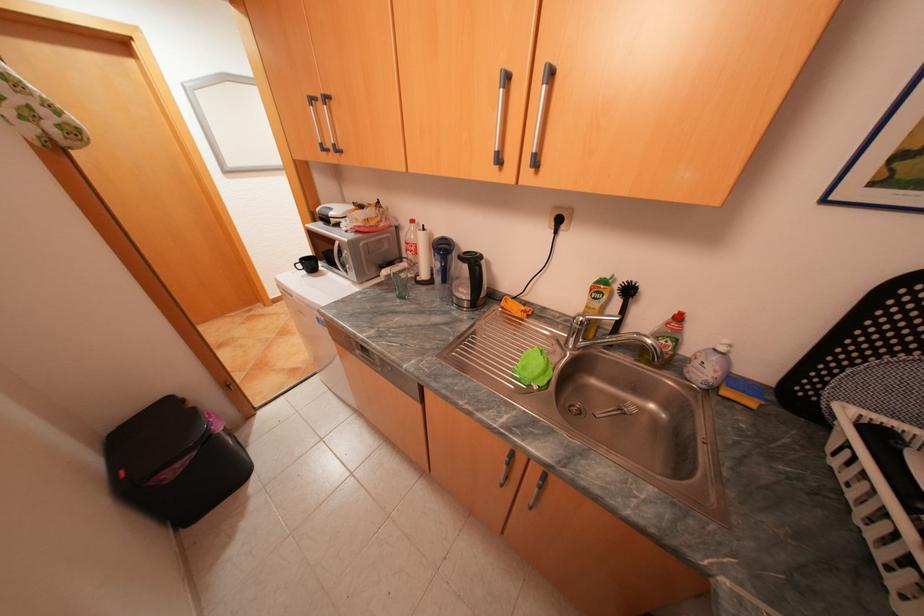
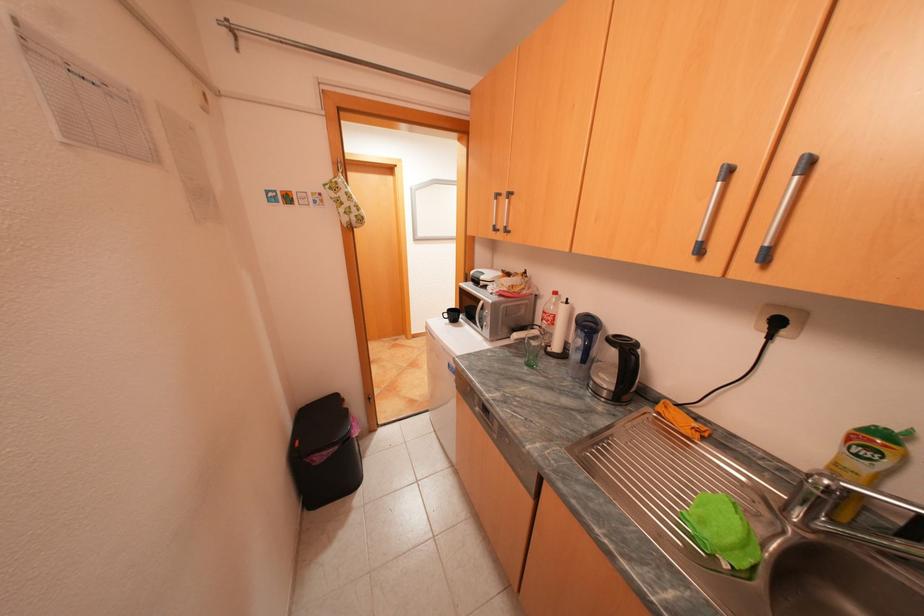
Locate, in the second image, the point that corresponds to point (568, 221) in the first image.

(786, 323)